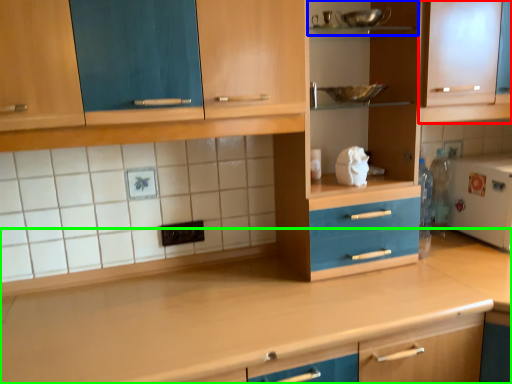
Question: Based on their relative distances, which object is farther from cabinetry (highlighted by a red box)? Choose from shelf (highlighted by a blue box) and countertop (highlighted by a green box).

Choices:
 (A) shelf
 (B) countertop

Answer: (B)